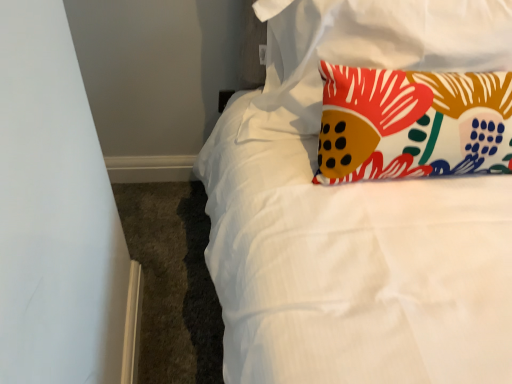
Question: Should I look upward or downward to see floral fabric pillow at upper right, which is the 2th pillow from bottom to top?

Choices:
 (A) down
 (B) up

Answer: (B)

Question: From the image's perspective, is floral fabric pillow at upper right, which is counted as the first pillow, starting from the top, located above floral fabric pillow at upper right, marked as the 1th pillow in a bottom-to-top arrangement?

Choices:
 (A) no
 (B) yes

Answer: (B)

Question: Is floral fabric pillow at upper right, which is counted as the first pillow, starting from the top, not near floral fabric pillow at upper right, the 2th pillow when ordered from top to bottom?

Choices:
 (A) yes
 (B) no

Answer: (B)

Question: Could floral fabric pillow at upper right, the 2th pillow when ordered from top to bottom, be considered to be inside floral fabric pillow at upper right, which is counted as the first pillow, starting from the top?

Choices:
 (A) no
 (B) yes

Answer: (A)

Question: Is floral fabric pillow at upper right, which is counted as the first pillow, starting from the top, beside floral fabric pillow at upper right, the 2th pillow when ordered from top to bottom?

Choices:
 (A) no
 (B) yes

Answer: (A)

Question: Considering the relative sizes of floral fabric pillow at upper right, which is counted as the first pillow, starting from the top, and floral fabric pillow at upper right, the 2th pillow when ordered from top to bottom, in the image provided, is floral fabric pillow at upper right, which is counted as the first pillow, starting from the top, wider than floral fabric pillow at upper right, the 2th pillow when ordered from top to bottom,?

Choices:
 (A) yes
 (B) no

Answer: (B)

Question: Considering the relative sizes of floral fabric pillow at upper right, which is the 2th pillow from bottom to top, and floral fabric pillow at upper right, marked as the 1th pillow in a bottom-to-top arrangement, in the image provided, is floral fabric pillow at upper right, which is the 2th pillow from bottom to top, bigger than floral fabric pillow at upper right, marked as the 1th pillow in a bottom-to-top arrangement,?

Choices:
 (A) no
 (B) yes

Answer: (B)

Question: Is floral fabric pillow at upper right, marked as the 1th pillow in a bottom-to-top arrangement, positioned far away from floral fabric pillow at upper right, which is the 2th pillow from bottom to top?

Choices:
 (A) no
 (B) yes

Answer: (A)

Question: Does floral fabric pillow at upper right, the 2th pillow when ordered from top to bottom, lie in front of floral fabric pillow at upper right, which is the 2th pillow from bottom to top?

Choices:
 (A) yes
 (B) no

Answer: (A)

Question: Does floral fabric pillow at upper right, the 2th pillow when ordered from top to bottom, have a larger size compared to floral fabric pillow at upper right, which is the 2th pillow from bottom to top?

Choices:
 (A) yes
 (B) no

Answer: (B)

Question: Does floral fabric pillow at upper right, the 2th pillow when ordered from top to bottom, lie behind floral fabric pillow at upper right, which is the 2th pillow from bottom to top?

Choices:
 (A) no
 (B) yes

Answer: (A)

Question: Can you confirm if floral fabric pillow at upper right, the 2th pillow when ordered from top to bottom, is wider than floral fabric pillow at upper right, which is counted as the first pillow, starting from the top?

Choices:
 (A) no
 (B) yes

Answer: (B)

Question: From the image's perspective, does floral fabric pillow at upper right, marked as the 1th pillow in a bottom-to-top arrangement, appear lower than floral fabric pillow at upper right, which is the 2th pillow from bottom to top?

Choices:
 (A) yes
 (B) no

Answer: (A)

Question: Visually, is floral fabric pillow at upper right, which is the 2th pillow from bottom to top, positioned to the left or to the right of floral fabric pillow at upper right, the 2th pillow when ordered from top to bottom?

Choices:
 (A) right
 (B) left

Answer: (B)